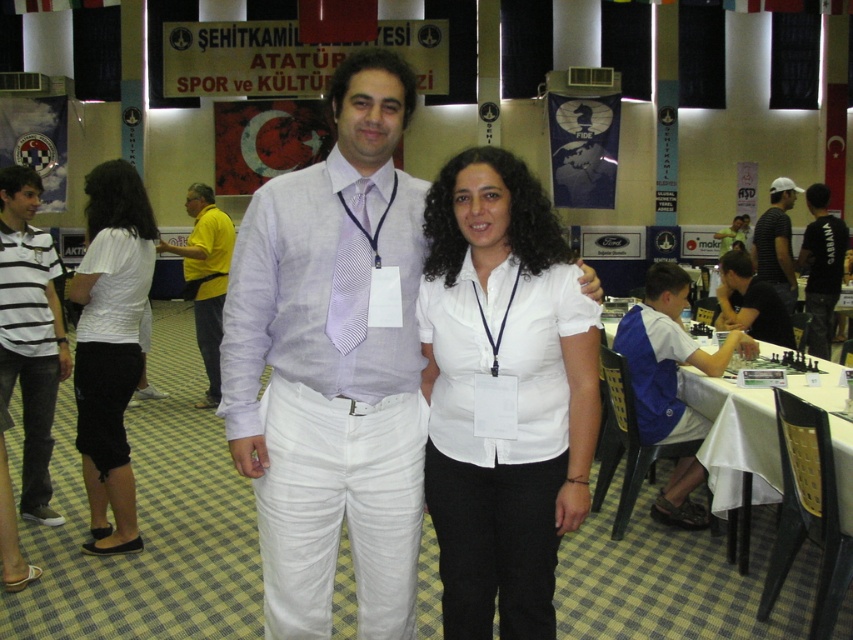
Question: Is white striped shirt at left further to camera compared to blue backpack at right?

Choices:
 (A) no
 (B) yes

Answer: (A)

Question: Which is farther from the dark blue shirt at center?

Choices:
 (A) yellow cotton shirt at center
 (B) black cotton t-shirt at right
 (C) white cotton shirt at center
 (D) white cotton shirt at left

Answer: (C)

Question: From the image, what is the correct spatial relationship of white striped shirt at left in relation to white cloth-covered table at right?

Choices:
 (A) below
 (B) above

Answer: (B)

Question: Among these objects, which one is nearest to the camera?

Choices:
 (A) lavender striped tie at center
 (B) dark blue shirt at center
 (C) white striped shirt at left

Answer: (A)

Question: From the image, what is the correct spatial relationship of white cotton shirt at center in relation to lavender striped tie at center?

Choices:
 (A) left
 (B) right

Answer: (B)

Question: Which point is closer to the camera?

Choices:
 (A) blue backpack at right
 (B) white cotton shirt at left

Answer: (B)